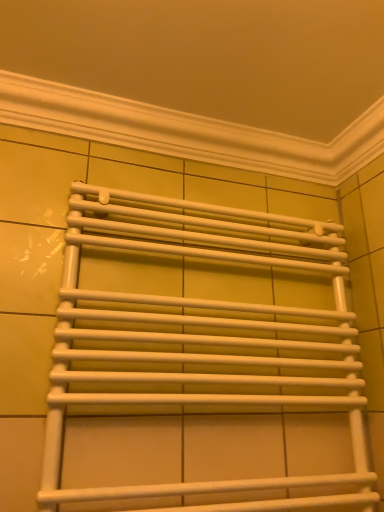
Identify the location of white matte towel rack at center. The height and width of the screenshot is (512, 384). (204, 339).

Image resolution: width=384 pixels, height=512 pixels. Describe the element at coordinates (204, 339) in the screenshot. I see `white matte towel rack at center` at that location.

The height and width of the screenshot is (512, 384). In order to click on white matte towel rack at center in this screenshot , I will do [x=204, y=339].